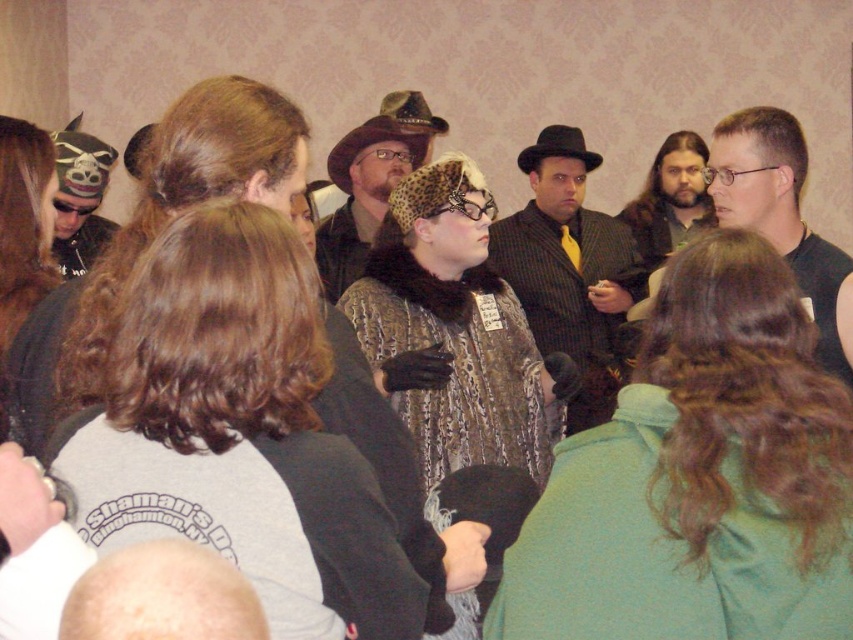
Question: Can you confirm if leopard print scarf at center is wider than leather cowboy hat at center?

Choices:
 (A) no
 (B) yes

Answer: (B)

Question: Is striped suit coat at center to the left of black felt cowboy hat at center from the viewer's perspective?

Choices:
 (A) no
 (B) yes

Answer: (B)

Question: Can you confirm if black matte shirt at right is smaller than black felt cowboy hat at center?

Choices:
 (A) no
 (B) yes

Answer: (A)

Question: Which object appears closest to the camera in this image?

Choices:
 (A) black matte shirt at right
 (B) matte black hat at left
 (C) leopard print scarf at center
 (D) striped suit coat at center

Answer: (A)

Question: Among these points, which one is farthest from the camera?

Choices:
 (A) (364, 237)
 (B) (334, 156)
 (C) (503, 264)
 (D) (76, 179)

Answer: (C)

Question: Which point is closer to the camera?

Choices:
 (A) matte black hat at left
 (B) black matte shirt at right
 (C) black felt cowboy hat at center

Answer: (B)